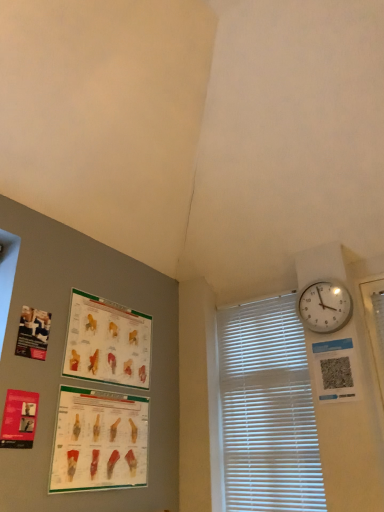
The height and width of the screenshot is (512, 384). What do you see at coordinates (107, 342) in the screenshot? I see `matte paper poster at upper left, which is the second poster page from top to bottom` at bounding box center [107, 342].

How much space does matte paper poster at upper left, which is the second poster page from top to bottom, occupy vertically?

The height of matte paper poster at upper left, which is the second poster page from top to bottom, is 41.82 centimeters.

Describe the element at coordinates (325, 306) in the screenshot. Image resolution: width=384 pixels, height=512 pixels. I see `white glossy wall clock at upper right` at that location.

You are a GUI agent. You are given a task and a screenshot of the screen. Output one action in this format:
    pyautogui.click(x=<x>, y=<y>)
    Task: Click on the matte paper poster at left, which is counted as the fourth poster page, starting from the bottom
    The height and width of the screenshot is (512, 384).
    Given the screenshot: What is the action you would take?
    pyautogui.click(x=33, y=333)

How much space does matte paper poster at left, which is counted as the fourth poster page, starting from the bottom, occupy vertically?

The height of matte paper poster at left, which is counted as the fourth poster page, starting from the bottom, is 8.62 inches.

Identify the location of matte paper poster at upper left, which is the second poster page from top to bottom. point(107,342).

Is white plastic blinds at right shorter than matte paper poster at lower left, the first poster page positioned from the bottom?

Incorrect, the height of white plastic blinds at right does not fall short of that of matte paper poster at lower left, the first poster page positioned from the bottom.

Considering the relative positions of white plastic blinds at right and matte paper poster at lower left, the first poster page positioned from the bottom, in the image provided, is white plastic blinds at right to the left or to the right of matte paper poster at lower left, the first poster page positioned from the bottom,?

white plastic blinds at right is positioned on matte paper poster at lower left, the first poster page positioned from the bottom,'s right side.

Between white plastic blinds at right and matte paper poster at lower left, marked as the fourth poster page in a top-to-bottom arrangement, which one is positioned behind?

white plastic blinds at right is further from the camera.

From the picture: Is matte paper poster at lower left, marked as the fourth poster page in a top-to-bottom arrangement, bigger than matte red poster at lower left, acting as the third poster page starting from the top?

Yes, matte paper poster at lower left, marked as the fourth poster page in a top-to-bottom arrangement, is bigger than matte red poster at lower left, acting as the third poster page starting from the top.

Is point (74, 409) more distant than point (9, 436)?

Yes, point (74, 409) is farther from viewer.

Is matte paper poster at lower left, marked as the fourth poster page in a top-to-bottom arrangement, inside or outside of matte red poster at lower left, which is the 2th poster page in bottom-to-top order?

matte paper poster at lower left, marked as the fourth poster page in a top-to-bottom arrangement, cannot be found inside matte red poster at lower left, which is the 2th poster page in bottom-to-top order.

Would you say white glossy wall clock at upper right contains white plastic blinds at right?

No, white plastic blinds at right is not inside white glossy wall clock at upper right.

Where is `window blind on the left of white glossy wall clock at upper right`? The image size is (384, 512). window blind on the left of white glossy wall clock at upper right is located at coordinates (267, 409).

Does point (340, 283) come farther from viewer compared to point (325, 507)?

Yes, point (340, 283) is farther from viewer.

Measure the distance between matte paper poster at upper left, positioned as the third poster page in bottom-to-top order, and matte paper poster at lower left, the first poster page positioned from the bottom.

The distance of matte paper poster at upper left, positioned as the third poster page in bottom-to-top order, from matte paper poster at lower left, the first poster page positioned from the bottom, is 25.45 centimeters.

Does point (107, 335) come farther from viewer compared to point (113, 407)?

Yes, it is.

Who is more distant, matte paper poster at upper left, which is the second poster page from top to bottom, or matte paper poster at lower left, the first poster page positioned from the bottom?

Positioned behind is matte paper poster at upper left, which is the second poster page from top to bottom.

Considering the relative positions of matte paper poster at upper left, which is the second poster page from top to bottom, and matte paper poster at lower left, marked as the fourth poster page in a top-to-bottom arrangement, in the image provided, is matte paper poster at upper left, which is the second poster page from top to bottom, to the left or to the right of matte paper poster at lower left, marked as the fourth poster page in a top-to-bottom arrangement,?

From the image, it's evident that matte paper poster at upper left, which is the second poster page from top to bottom, is to the left of matte paper poster at lower left, marked as the fourth poster page in a top-to-bottom arrangement.

From the image's perspective, is matte paper poster at left, the 1th poster page positioned from the top, above or below white glossy wall clock at upper right?

Clearly, from the image's perspective, matte paper poster at left, the 1th poster page positioned from the top, is below white glossy wall clock at upper right.

Looking at this image, what's the angular difference between matte paper poster at left, which is counted as the fourth poster page, starting from the bottom, and white glossy wall clock at upper right's facing directions?

89.2 degrees.

Considering the relative sizes of matte paper poster at left, which is counted as the fourth poster page, starting from the bottom, and white glossy wall clock at upper right in the image provided, is matte paper poster at left, which is counted as the fourth poster page, starting from the bottom, shorter than white glossy wall clock at upper right?

Indeed, matte paper poster at left, which is counted as the fourth poster page, starting from the bottom, has a lesser height compared to white glossy wall clock at upper right.

There is a white glossy wall clock at upper right. Where is `the 2nd poster page below it (from a real-world perspective)`? Image resolution: width=384 pixels, height=512 pixels. the 2nd poster page below it (from a real-world perspective) is located at coordinates (33, 333).

Which is nearer, (7, 442) or (77, 419)?

The point (7, 442) is closer.

Is matte red poster at lower left, acting as the third poster page starting from the top, positioned beyond the bounds of matte paper poster at lower left, marked as the fourth poster page in a top-to-bottom arrangement?

That's correct, matte red poster at lower left, acting as the third poster page starting from the top, is outside of matte paper poster at lower left, marked as the fourth poster page in a top-to-bottom arrangement.

Are matte red poster at lower left, which is the 2th poster page in bottom-to-top order, and matte paper poster at lower left, marked as the fourth poster page in a top-to-bottom arrangement, located far from each other?

No.

From a real-world perspective, which poster page is the 1st one above the matte paper poster at lower left, marked as the fourth poster page in a top-to-bottom arrangement? Please provide its 2D coordinates.

[(19, 419)]

Could you measure the distance between white glossy wall clock at upper right and matte paper poster at upper left, which is the second poster page from top to bottom?

3.29 feet.

Would you say white glossy wall clock at upper right is outside matte paper poster at upper left, which is the second poster page from top to bottom?

Yes, white glossy wall clock at upper right is located beyond the bounds of matte paper poster at upper left, which is the second poster page from top to bottom.

The image size is (384, 512). Identify the location of poster page that is the 1st object located in front of the white glossy wall clock at upper right. (107, 342).

From the image's perspective, is white glossy wall clock at upper right over matte paper poster at upper left, positioned as the third poster page in bottom-to-top order?

Yes, from the image's perspective, white glossy wall clock at upper right is over matte paper poster at upper left, positioned as the third poster page in bottom-to-top order.

What are the coordinates of `window blind above the matte paper poster at lower left, the first poster page positioned from the bottom (from a real-world perspective)` in the screenshot? It's located at (267, 409).

Where is `poster page that is below the matte red poster at lower left, which is the 2th poster page in bottom-to-top order (from the image's perspective)`? Image resolution: width=384 pixels, height=512 pixels. poster page that is below the matte red poster at lower left, which is the 2th poster page in bottom-to-top order (from the image's perspective) is located at coordinates (99, 441).

Looking at the image, which one is located further to matte red poster at lower left, which is the 2th poster page in bottom-to-top order, white glossy wall clock at upper right or matte paper poster at left, the 1th poster page positioned from the top?

The object further to matte red poster at lower left, which is the 2th poster page in bottom-to-top order, is white glossy wall clock at upper right.

Consider the image. When comparing their distances from matte red poster at lower left, which is the 2th poster page in bottom-to-top order, does matte paper poster at left, the 1th poster page positioned from the top, or matte paper poster at upper left, positioned as the third poster page in bottom-to-top order, seem further?

matte paper poster at upper left, positioned as the third poster page in bottom-to-top order, lies further to matte red poster at lower left, which is the 2th poster page in bottom-to-top order, than the other object.

Which object lies nearer to the anchor point white plastic blinds at right, matte paper poster at upper left, positioned as the third poster page in bottom-to-top order, or white glossy wall clock at upper right?

Among the two, white glossy wall clock at upper right is located nearer to white plastic blinds at right.

Consider the image. Based on their spatial positions, is matte paper poster at left, which is counted as the fourth poster page, starting from the bottom, or matte paper poster at lower left, the first poster page positioned from the bottom, closer to white plastic blinds at right?

matte paper poster at lower left, the first poster page positioned from the bottom.

When comparing their distances from matte paper poster at lower left, marked as the fourth poster page in a top-to-bottom arrangement, does matte paper poster at left, which is counted as the fourth poster page, starting from the bottom, or white plastic blinds at right seem further?

white plastic blinds at right is positioned further to the anchor matte paper poster at lower left, marked as the fourth poster page in a top-to-bottom arrangement.

When comparing their distances from matte paper poster at upper left, positioned as the third poster page in bottom-to-top order, does matte paper poster at left, the 1th poster page positioned from the top, or matte paper poster at lower left, marked as the fourth poster page in a top-to-bottom arrangement, seem further?

matte paper poster at left, the 1th poster page positioned from the top.

Considering their positions, is matte paper poster at left, which is counted as the fourth poster page, starting from the bottom, positioned closer to white plastic blinds at right than white glossy wall clock at upper right?

Among the two, white glossy wall clock at upper right is located nearer to white plastic blinds at right.

When comparing their distances from white glossy wall clock at upper right, does matte paper poster at lower left, the first poster page positioned from the bottom, or matte paper poster at upper left, positioned as the third poster page in bottom-to-top order, seem closer?

matte paper poster at upper left, positioned as the third poster page in bottom-to-top order.

This screenshot has height=512, width=384. Identify the location of poster page between matte paper poster at left, the 1th poster page positioned from the top, and matte red poster at lower left, which is the 2th poster page in bottom-to-top order, in the vertical direction. point(107,342).

The width and height of the screenshot is (384, 512). I want to click on poster page situated between matte paper poster at upper left, which is the second poster page from top to bottom, and white glossy wall clock at upper right from left to right, so click(x=99, y=441).

Identify the location of window blind between matte paper poster at upper left, positioned as the third poster page in bottom-to-top order, and white glossy wall clock at upper right from left to right. Image resolution: width=384 pixels, height=512 pixels. (267, 409).

The width and height of the screenshot is (384, 512). In order to click on window blind situated between matte paper poster at lower left, the first poster page positioned from the bottom, and white glossy wall clock at upper right from left to right in this screenshot , I will do `click(267, 409)`.